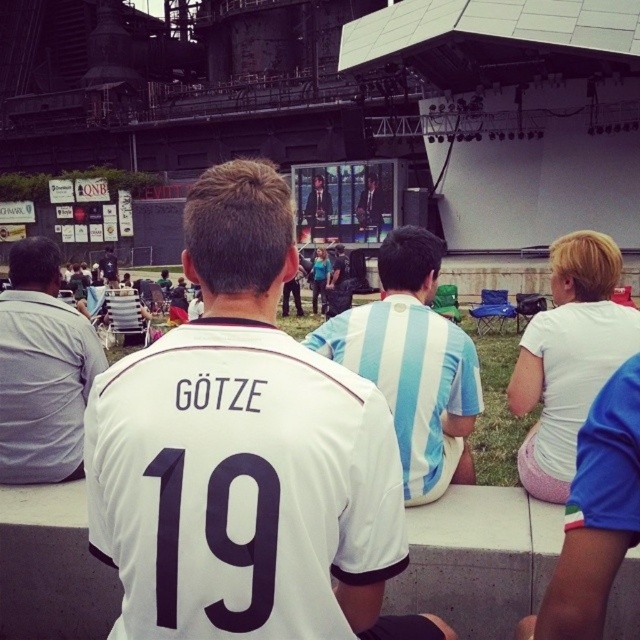
Question: Is gray cotton shirt at left above purple fabric/texture at center?

Choices:
 (A) yes
 (B) no

Answer: (A)

Question: Estimate the real-world distances between objects in this image. Which object is closer to the white matte shorts at lower right?

Choices:
 (A) purple fabric/texture at center
 (B) white jersey at center

Answer: (B)

Question: Is white striped jersey at center thinner than matte white jersey at center?

Choices:
 (A) yes
 (B) no

Answer: (A)

Question: Which of these objects is positioned farthest from the purple fabric/texture at center?

Choices:
 (A) white matte shorts at lower right
 (B) gray cotton shirt at left
 (C) matte white jersey at center
 (D) white jersey at center

Answer: (C)

Question: Does smooth suit at center appear over matte white jersey at center?

Choices:
 (A) yes
 (B) no

Answer: (A)

Question: Considering the real-world distances, which object is farthest from the purple fabric/texture at center?

Choices:
 (A) white striped jersey at center
 (B) matte white jersey at center
 (C) white jersey at center
 (D) smooth suit at center

Answer: (D)